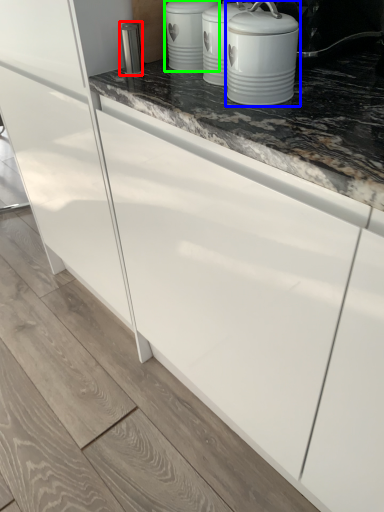
Question: Considering the real-world distances, which object is closest to appliance (highlighted by a red box)? home appliance (highlighted by a blue box) or kitchen appliance (highlighted by a green box).

Choices:
 (A) home appliance
 (B) kitchen appliance

Answer: (B)